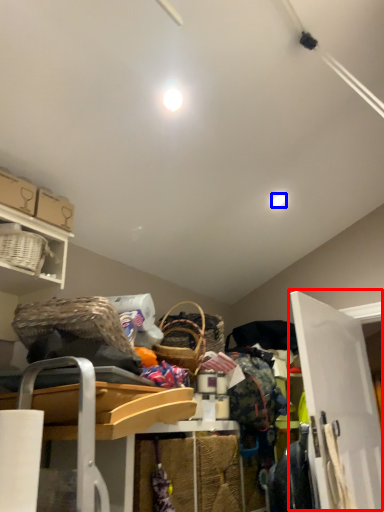
Question: Which object appears closest to the camera in this image, door (highlighted by a red box) or light (highlighted by a blue box)?

Choices:
 (A) door
 (B) light

Answer: (A)